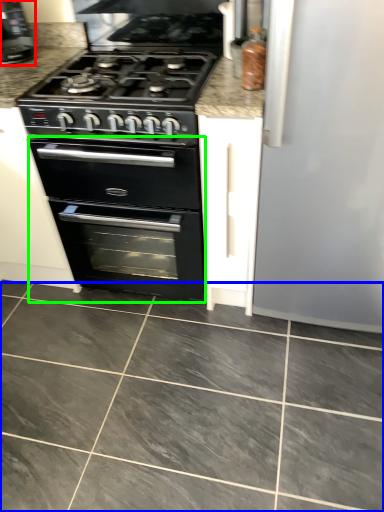
Question: Which is nearer to the coffee machine (highlighted by a red box)? ceramic tile (highlighted by a blue box) or oven (highlighted by a green box).

Choices:
 (A) ceramic tile
 (B) oven

Answer: (B)